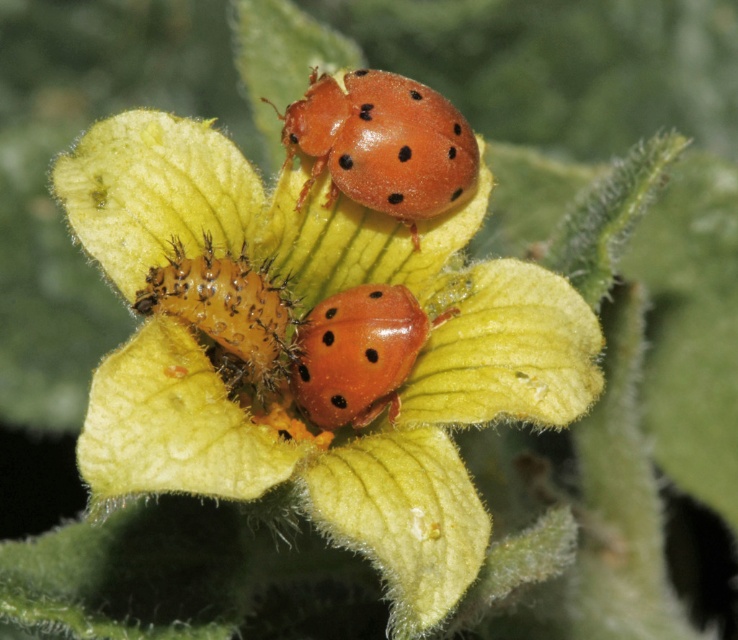
Question: Does smooth yellow flower at center come behind fuzzy orange caterpillar at center?

Choices:
 (A) no
 (B) yes

Answer: (A)

Question: Is matte orange beetle at upper center thinner than shiny orange ladybird at center?

Choices:
 (A) yes
 (B) no

Answer: (B)

Question: Which point appears farthest from the camera in this image?

Choices:
 (A) (413, 156)
 (B) (368, 296)
 (C) (179, 154)
 (D) (244, 253)

Answer: (B)

Question: Estimate the real-world distances between objects in this image. Which object is farther from the fuzzy orange caterpillar at center?

Choices:
 (A) smooth yellow flower at center
 (B) matte orange beetle at upper center
 (C) shiny orange ladybird at center

Answer: (B)

Question: Estimate the real-world distances between objects in this image. Which object is farther from the smooth yellow flower at center?

Choices:
 (A) shiny orange ladybird at center
 (B) matte orange beetle at upper center
 (C) fuzzy orange caterpillar at center

Answer: (B)

Question: Does matte orange beetle at upper center have a lesser width compared to shiny orange ladybird at center?

Choices:
 (A) yes
 (B) no

Answer: (B)